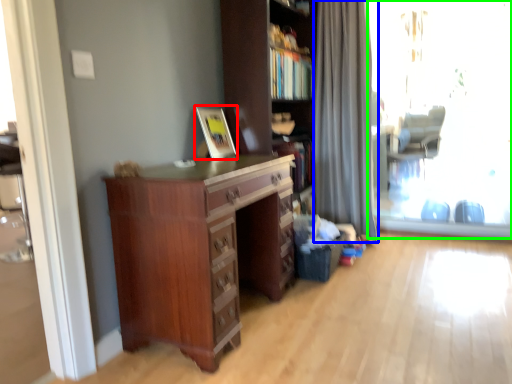
Question: Considering the real-world distances, which object is farthest from picture frame (highlighted by a red box)? curtain (highlighted by a blue box) or window screen (highlighted by a green box)?

Choices:
 (A) curtain
 (B) window screen

Answer: (B)